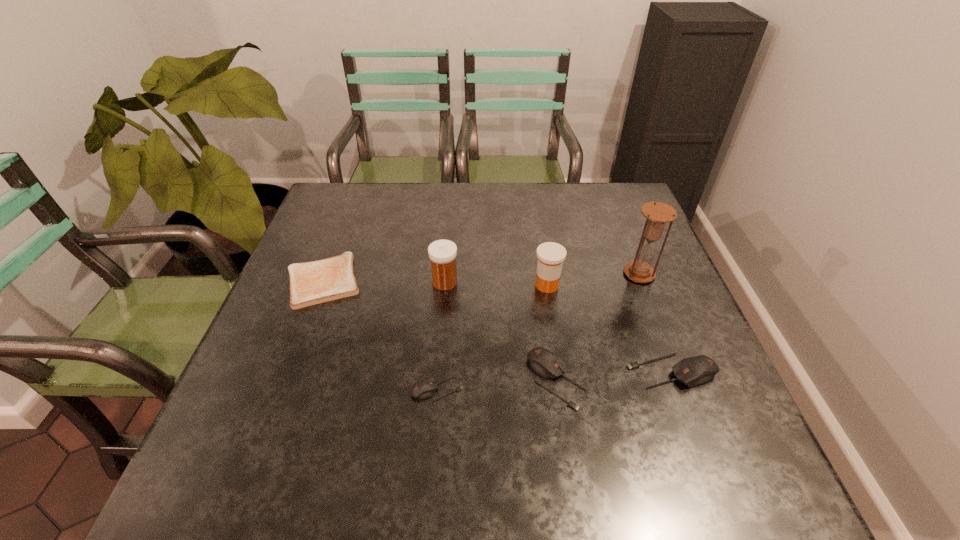
Find the location of a particular element. This screenshot has height=540, width=960. the second shortest object is located at coordinates (425, 388).

Image resolution: width=960 pixels, height=540 pixels. I want to click on the shortest mouse, so click(425, 388).

In order to click on the second tallest mouse in this screenshot , I will do `click(547, 364)`.

This screenshot has width=960, height=540. What are the coordinates of `the second mouse from right to left` in the screenshot? It's located at (547, 364).

Where is `the rightmost mouse`? This screenshot has width=960, height=540. the rightmost mouse is located at coordinates (692, 371).

Identify the location of the left medicine. (442, 253).

Identify the location of the right medicine. The width and height of the screenshot is (960, 540). (551, 255).

Image resolution: width=960 pixels, height=540 pixels. Identify the location of toast. (315, 282).

I want to click on the leftmost object, so click(x=315, y=282).

You are a GUI agent. You are given a task and a screenshot of the screen. Output one action in this format:
    pyautogui.click(x=<x>, y=<y>)
    Task: Click on the tallest object
    This screenshot has width=960, height=540.
    Given the screenshot: What is the action you would take?
    658,214